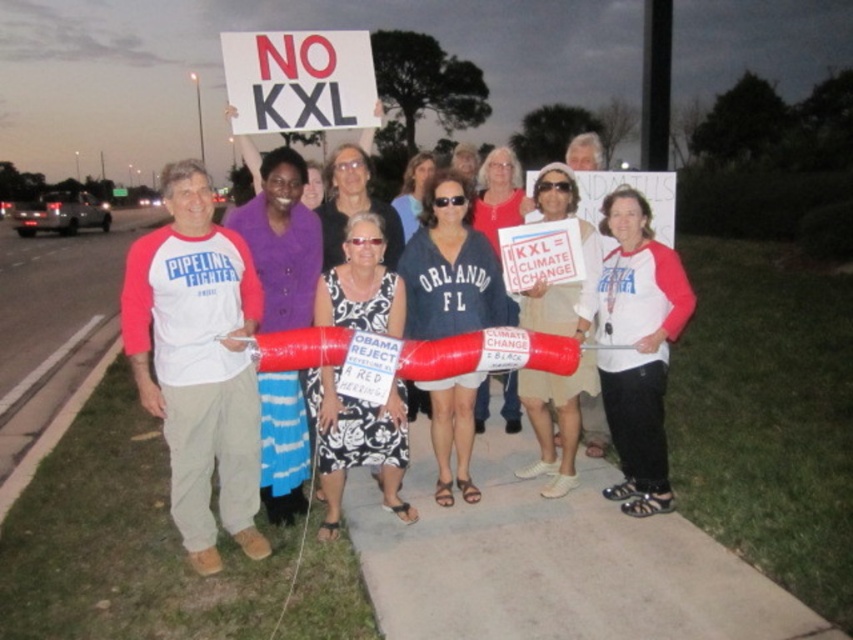
You are a photographer standing at the edge of the protest area. You want to take a photo that includes both the white plastic sign at upper center and the matte white shirt at center. The camera you are using has a maximum focus range of 5 feet. Will both objects be in focus if you focus on the closer one?

The distance between the white plastic sign at upper center and the matte white shirt at center is 5.61 feet. If you focus on the closer object, the maximum focus range of 5 feet may not cover the farther object, so they might not both be in focus.

You are a photographer standing at the protest site. You want to take a closeup photo of the white plastic sign at upper center. Given that your camera can focus on objects within 15 feet, will you be able to capture a clear closeup of the sign?

The white plastic sign at upper center is 14.98 feet away from the viewer, which is within the camera focus range of 15 feet. Therefore, you can capture a clear closeup of the sign.

In the protest scene, where exactly is the white plastic sign at upper center located in terms of its 2D coordinates?

The white plastic sign at upper center is located at the 2D coordinates of point [299,81].